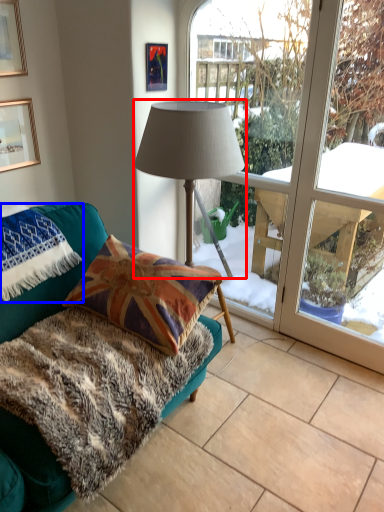
Question: Which object appears farthest to the camera in this image, lamp (highlighted by a red box) or blanket (highlighted by a blue box)?

Choices:
 (A) lamp
 (B) blanket

Answer: (B)